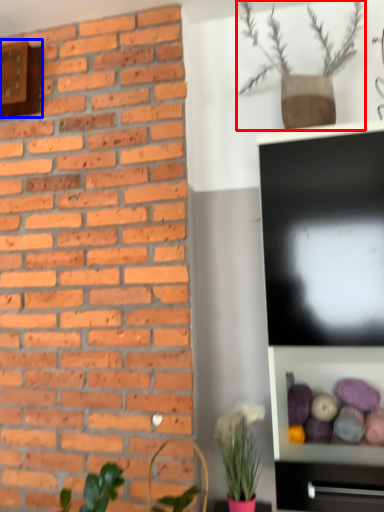
Question: Which object is further to the camera taking this photo, houseplant (highlighted by a red box) or clock (highlighted by a blue box)?

Choices:
 (A) houseplant
 (B) clock

Answer: (B)